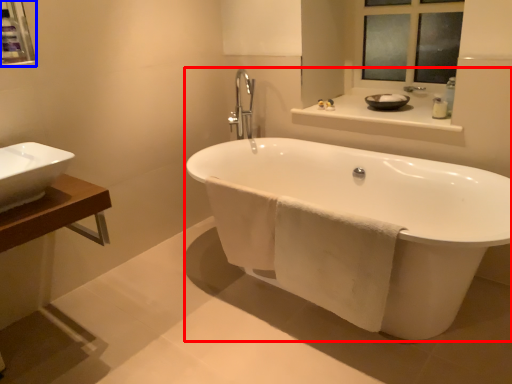
Question: Which object is further to the camera taking this photo, bathtub (highlighted by a red box) or medicine cabinet (highlighted by a blue box)?

Choices:
 (A) bathtub
 (B) medicine cabinet

Answer: (B)